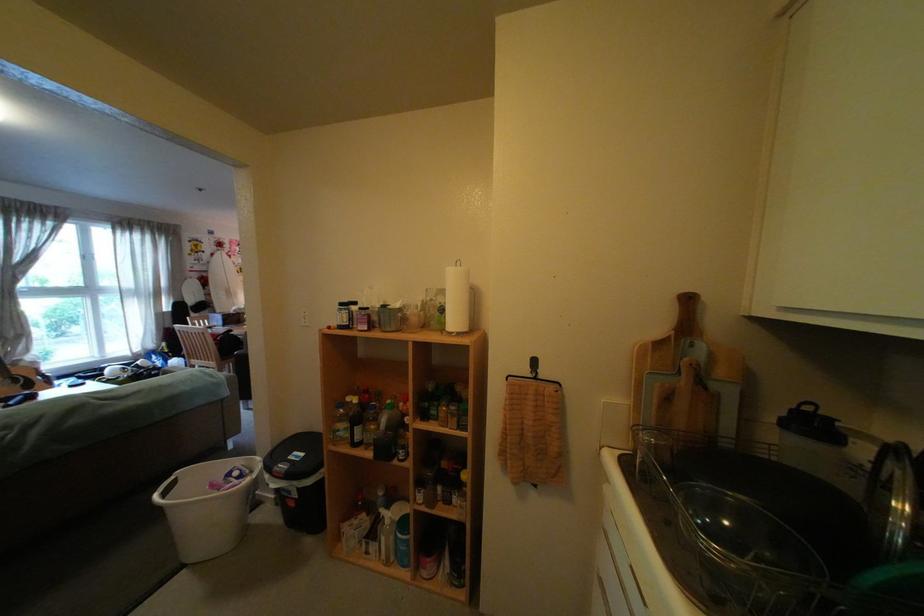
Where is `pot lid handle`? pot lid handle is located at coordinates (820, 419).